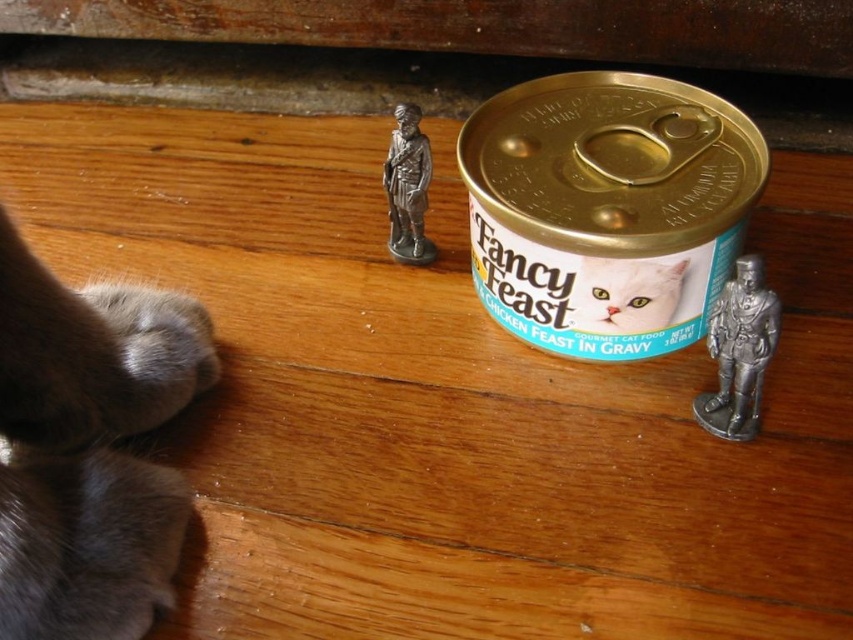
What are the coordinates of `fuzzy fur paw at lower left` in the screenshot? It's located at (90, 449).

The width and height of the screenshot is (853, 640). Describe the element at coordinates (90, 449) in the screenshot. I see `fuzzy fur paw at lower left` at that location.

Find the location of `fuzzy fur paw at lower left`. fuzzy fur paw at lower left is located at coordinates (90, 449).

How distant is fuzzy fur paw at lower left from metallic figure at center-right?

26.39 inches

Between fuzzy fur paw at lower left and metallic figure at center-right, which one appears on the left side from the viewer's perspective?

fuzzy fur paw at lower left is more to the left.

Identify the location of fuzzy fur paw at lower left. (90, 449).

Who is positioned more to the right, metallic figure at center-right or white glossy cat food can at center?

Positioned to the right is metallic figure at center-right.

Describe the element at coordinates (740, 349) in the screenshot. I see `metallic figure at center-right` at that location.

Which is in front, point (723, 388) or point (627, 266)?

Point (627, 266)

In order to click on metallic figure at center-right in this screenshot , I will do `click(740, 349)`.